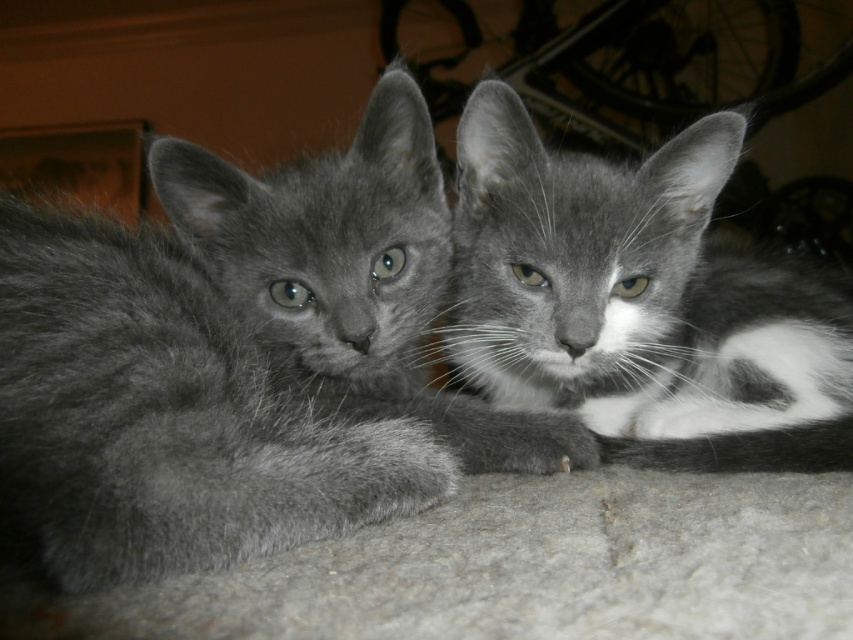
Does soft gray fur cat at center have a lesser height compared to gray fur cat at center?

No, soft gray fur cat at center is not shorter than gray fur cat at center.

Is point (178, 419) farther from camera compared to point (556, 220)?

No, (178, 419) is in front of (556, 220).

Where is `soft gray fur cat at center`? This screenshot has height=640, width=853. soft gray fur cat at center is located at coordinates (241, 362).

Locate an element on the screen. The height and width of the screenshot is (640, 853). soft gray fur cat at center is located at coordinates (241, 362).